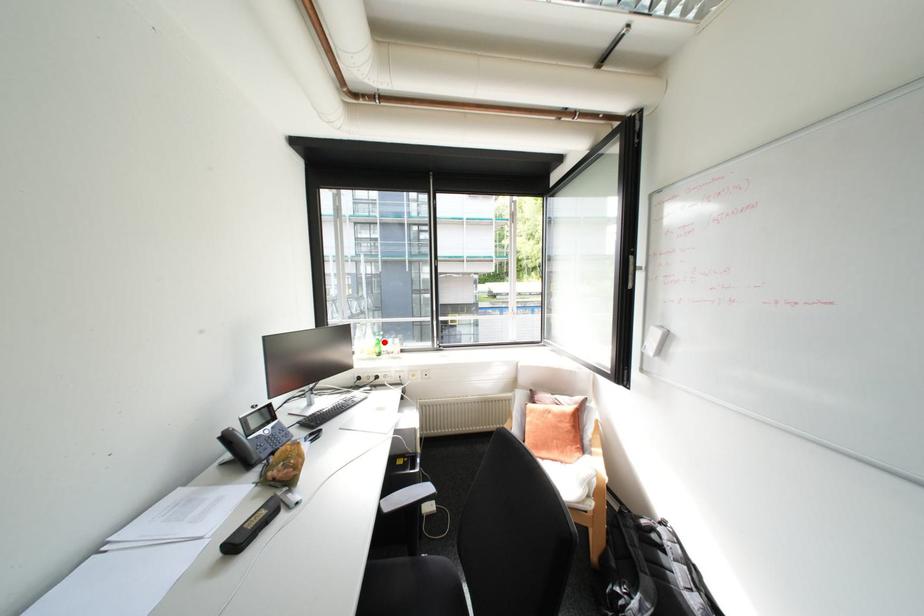
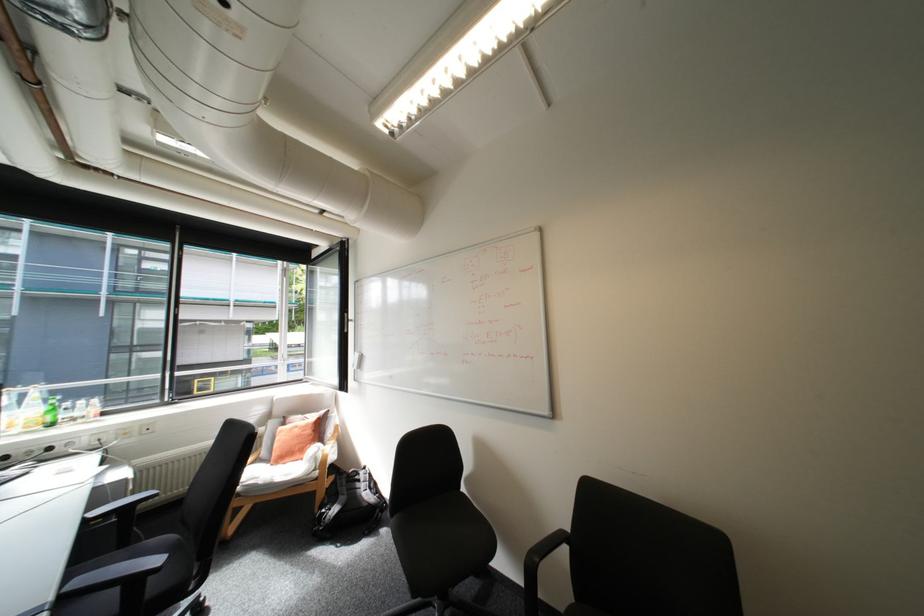
Question: A red point is marked in image1. In image2, is the corresponding 3D point closer to the camera or farther? Reply with the corresponding letter.

Choices:
 (A) The corresponding 3D point is closer.
 (B) The corresponding 3D point is farther.

Answer: (A)